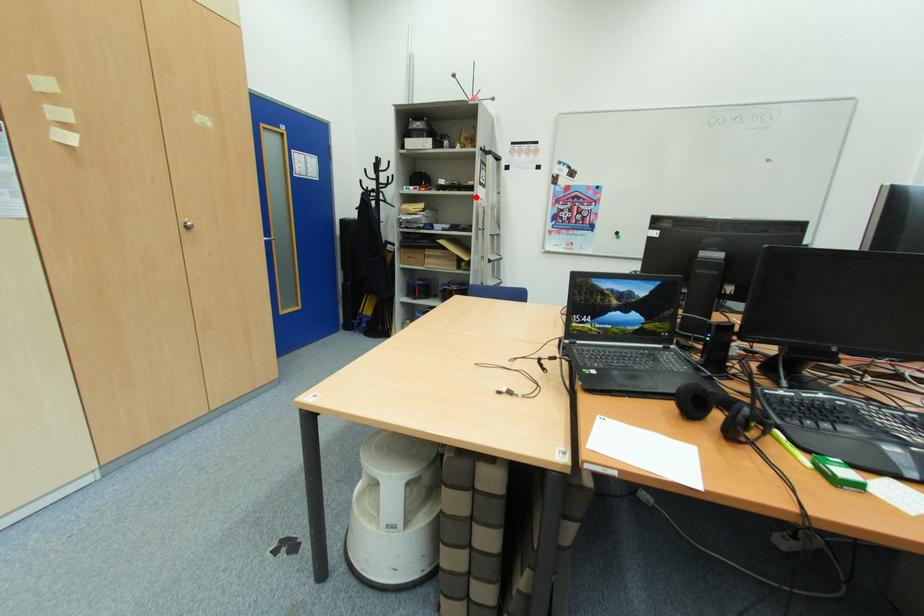
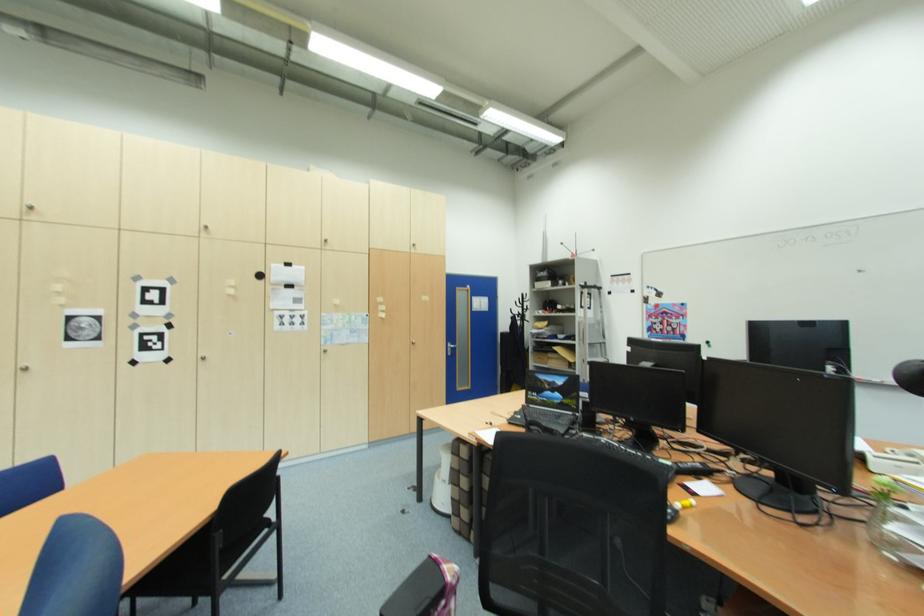
Where in the second image is the point corresponding to the highlighted location from the first image?

(578, 317)